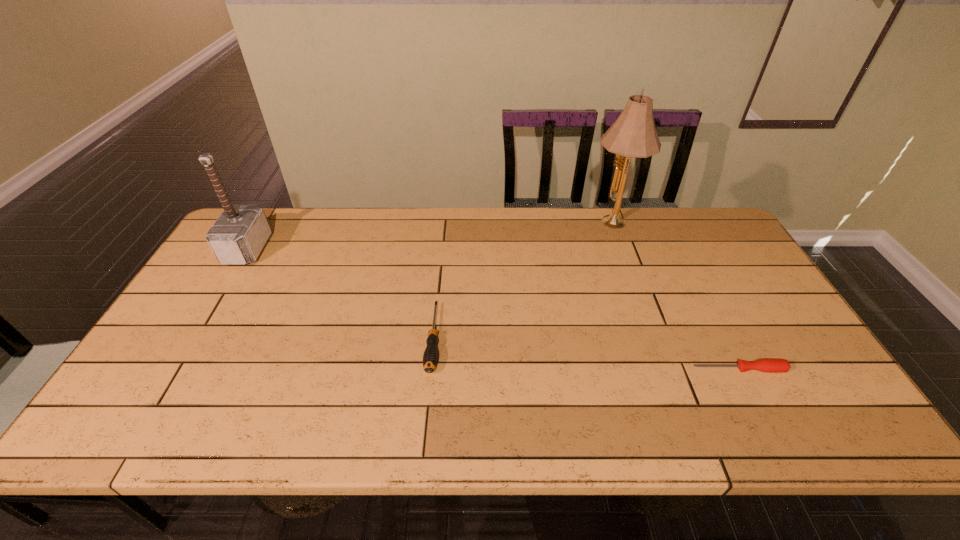
The image size is (960, 540). In order to click on vacant area situated at the tip of the shorter screwdriver in this screenshot , I will do `click(647, 369)`.

Image resolution: width=960 pixels, height=540 pixels. Identify the location of free space located 0.080m at the tip of the shorter screwdriver. (660, 369).

Locate an element on the screen. This screenshot has width=960, height=540. free space located 0.340m at the tip of the shorter screwdriver is located at coordinates (553, 369).

At what (x,y) coordinates should I click in order to perform the action: click on lampshade located in the far edge section of the desktop. Please return your answer as a coordinate pair (x, y). Looking at the image, I should click on (633, 135).

Locate an element on the screen. This screenshot has height=540, width=960. hammer that is at the far edge is located at coordinates (239, 234).

You are a GUI agent. You are given a task and a screenshot of the screen. Output one action in this format:
    pyautogui.click(x=<x>, y=<y>)
    Task: Click on the object that is at the left edge
    This screenshot has width=960, height=540.
    Given the screenshot: What is the action you would take?
    pyautogui.click(x=239, y=234)

I want to click on object that is positioned at the right edge, so click(763, 365).

This screenshot has width=960, height=540. In order to click on object located at the far left corner in this screenshot , I will do `click(239, 234)`.

Identify the location of free space at the far edge of the desktop. This screenshot has width=960, height=540. (522, 227).

The width and height of the screenshot is (960, 540). Identify the location of vacant space at the near edge of the desktop. (506, 422).